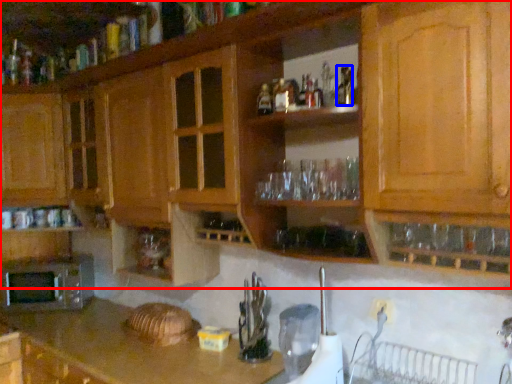
Question: Which of the following is the closest to the observer, cabinetry (highlighted by a red box) or bottle (highlighted by a blue box)?

Choices:
 (A) cabinetry
 (B) bottle

Answer: (A)